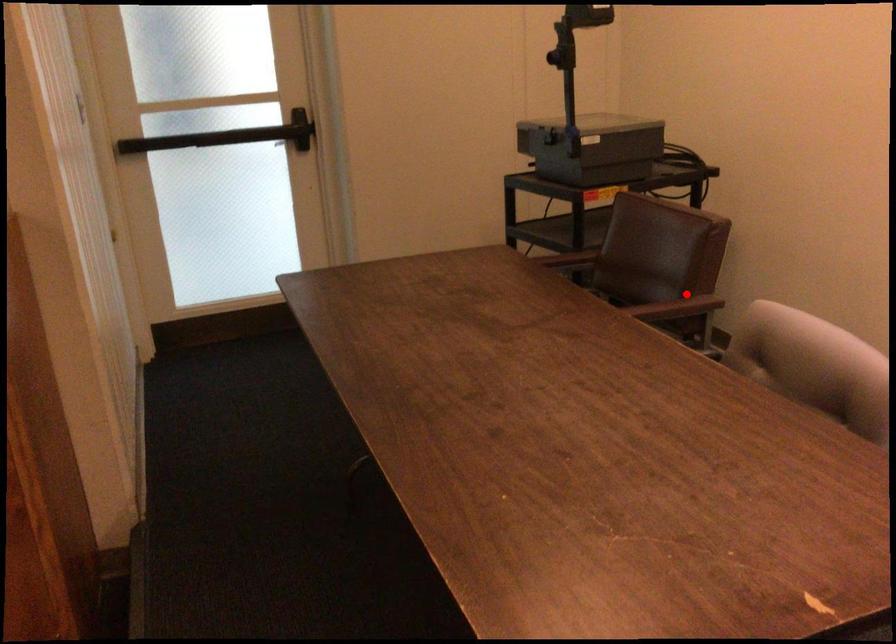
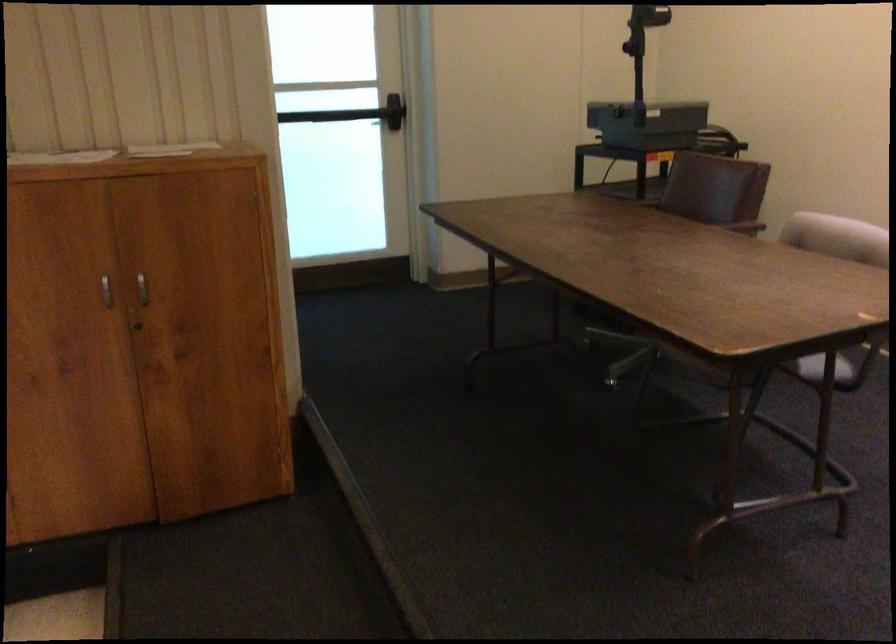
Question: I am providing you with two images of the same scene from different viewpoints. Image1 has a red point marked. In image2, the corresponding 3D location appears at what relative position? Reply with the corresponding letter.

Choices:
 (A) Closer
 (B) Farther

Answer: (B)